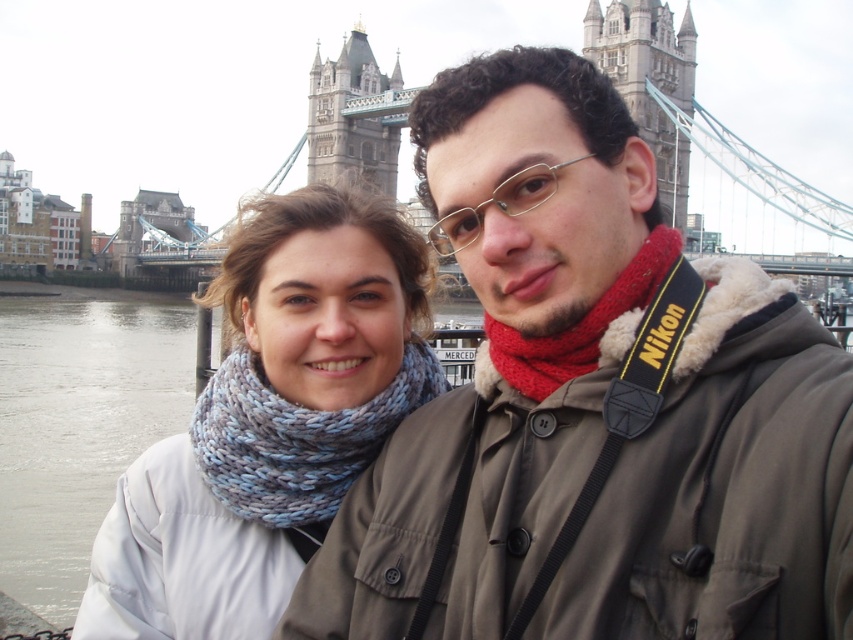
You are a photographer trying to capture both the blue knitted scarf at center and the blue knitted scarf at left in a single frame. Based on their positions, which scarf is closer to the camera?

The blue knitted scarf at center is positioned under the blue knitted scarf at left, meaning it is closer to the camera.

You are a tourist guide explaining the location of the scarves to visitors. Point out the direction of the blue knitted scarf at center relative to the red knitted scarf at center.

The blue knitted scarf at center is located to the left of the red knitted scarf at center.

You are a photographer trying to capture the Tower Bridge in London. You notice a person wearing a matte khaki jacket at center in your frame. Where exactly is this person positioned in the image?

The matte khaki jacket at center is positioned at coordinates point (592, 406) in the image.